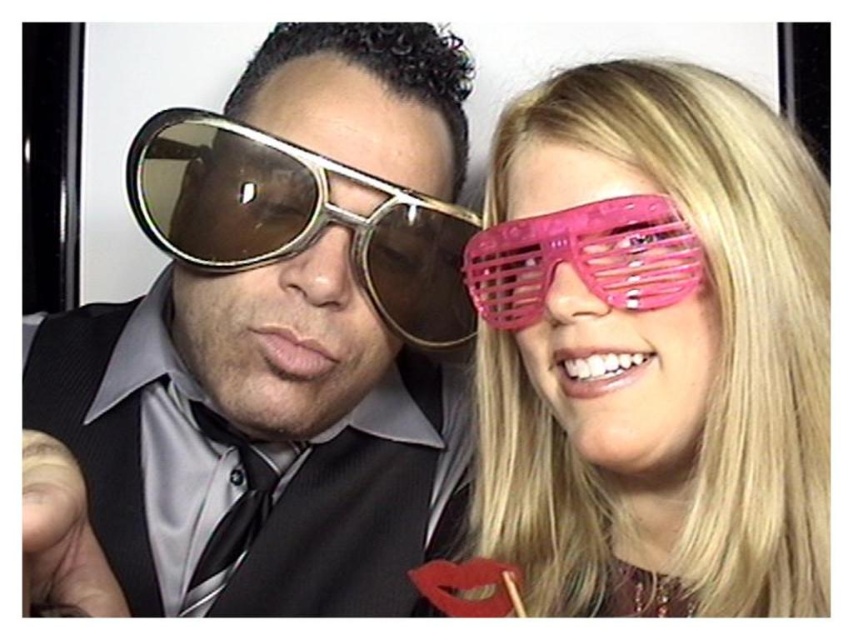
Question: Which object is the farthest from the gold reflective sunglasses at left?

Choices:
 (A) pink plastic glasses at right
 (B) metallic gold sunglasses at left

Answer: (A)

Question: Can you confirm if metallic gold sunglasses at left is smaller than pink plastic glasses at right?

Choices:
 (A) yes
 (B) no

Answer: (B)

Question: Which point is closer to the camera?

Choices:
 (A) (189, 252)
 (B) (740, 362)
 (C) (302, 609)

Answer: (B)

Question: Can you confirm if metallic gold sunglasses at left is positioned above gold reflective sunglasses at left?

Choices:
 (A) no
 (B) yes

Answer: (A)

Question: Which of these objects is positioned closest to the metallic gold sunglasses at left?

Choices:
 (A) gold reflective sunglasses at left
 (B) pink plastic glasses at right

Answer: (A)

Question: Considering the relative positions of metallic gold sunglasses at left and gold reflective sunglasses at left in the image provided, where is metallic gold sunglasses at left located with respect to gold reflective sunglasses at left?

Choices:
 (A) left
 (B) right

Answer: (A)